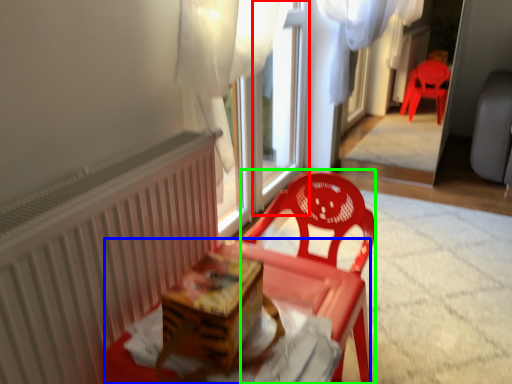
Question: Which is nearer to the window frame (highlighted by a red box)? table (highlighted by a blue box) or chair (highlighted by a green box).

Choices:
 (A) table
 (B) chair

Answer: (B)